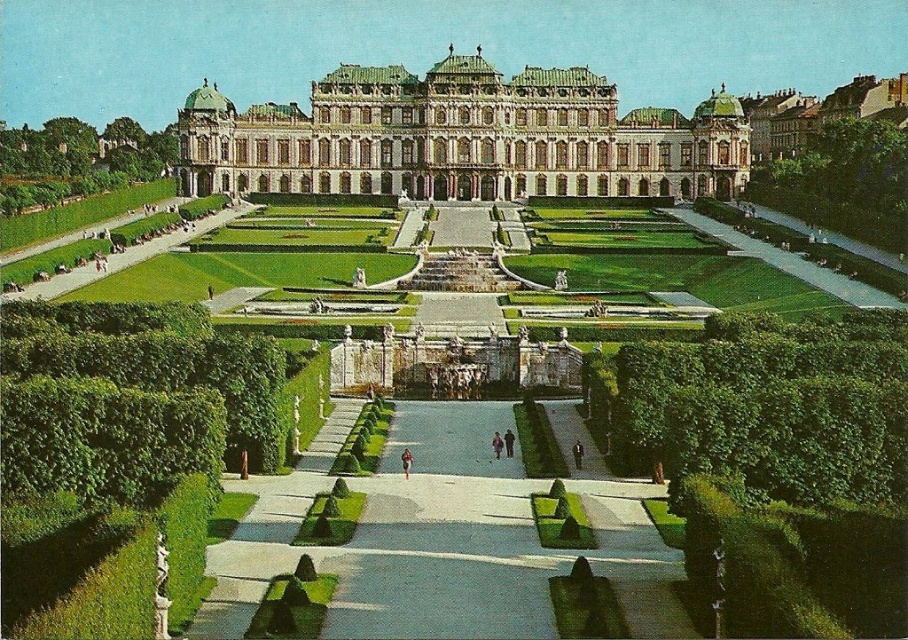
Between green leafy hedge at lower right and green leafy hedge at lower left, which one appears on the left side from the viewer's perspective?

green leafy hedge at lower left is more to the left.

Does green leafy hedge at lower right appear under green leafy hedge at lower left?

Yes, green leafy hedge at lower right is below green leafy hedge at lower left.

Between point (867, 365) and point (274, 349), which one is positioned behind?

The point (274, 349) is behind.

In order to click on green leafy hedge at lower right in this screenshot , I will do `click(767, 404)`.

Does green leafy hedge at lower right appear on the left side of green leafy hedge at upper right?

Correct, you'll find green leafy hedge at lower right to the left of green leafy hedge at upper right.

This screenshot has width=908, height=640. Describe the element at coordinates (767, 404) in the screenshot. I see `green leafy hedge at lower right` at that location.

Measure the distance between point (755, 481) and camera.

Point (755, 481) and camera are 329.30 feet apart.

You are a GUI agent. You are given a task and a screenshot of the screen. Output one action in this format:
    pyautogui.click(x=<x>, y=<y>)
    Task: Click on the green leafy hedge at lower right
    
    Given the screenshot: What is the action you would take?
    pyautogui.click(x=767, y=404)

Between green tiled roof at center and green leafy hedge at lower right, which one appears on the left side from the viewer's perspective?

From the viewer's perspective, green tiled roof at center appears more on the left side.

Between green tiled roof at center and green leafy hedge at lower right, which one is positioned higher?

Positioned higher is green tiled roof at center.

Between point (347, 115) and point (593, 381), which one is positioned behind?

Point (347, 115)

Where is `green tiled roof at center`? Image resolution: width=908 pixels, height=640 pixels. green tiled roof at center is located at coordinates (462, 138).